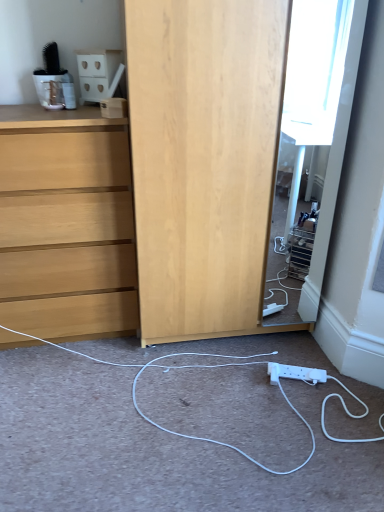
Question: Would you say white matte cabinet at upper left is to the left or to the right of light wood chest of drawers at left in the picture?

Choices:
 (A) right
 (B) left

Answer: (A)

Question: From a real-world perspective, is white matte cabinet at upper left positioned above or below light wood chest of drawers at left?

Choices:
 (A) below
 (B) above

Answer: (B)

Question: Considering the real-world distances, which object is closest to the white plastic power strip at lower center?

Choices:
 (A) light wood chest of drawers at left
 (B) white matte cabinet at upper left
 (C) white plastic power strip at lower center

Answer: (C)

Question: Estimate the real-world distances between objects in this image. Which object is farther from the light wood chest of drawers at left?

Choices:
 (A) white plastic power strip at lower center
 (B) white matte cabinet at upper left
 (C) white plastic power strip at lower center

Answer: (A)